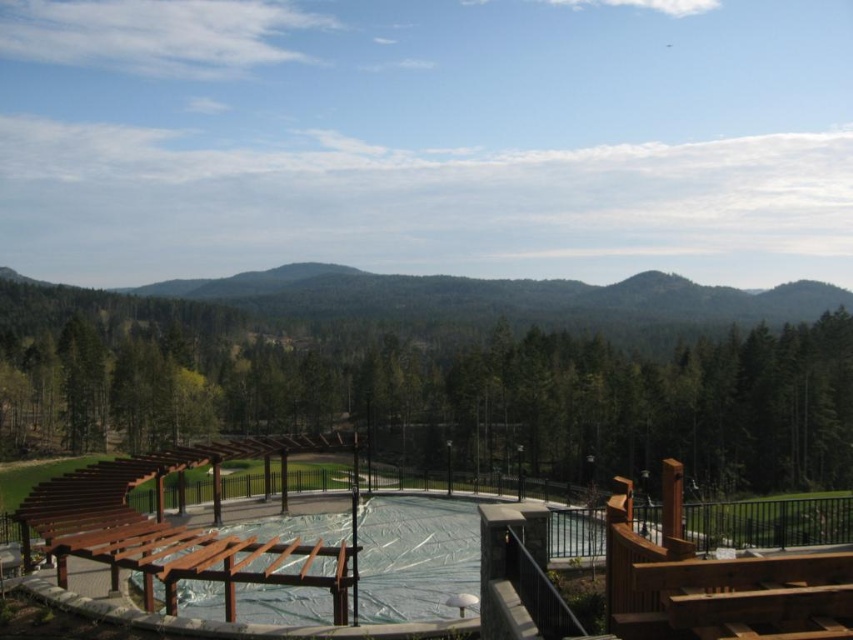
Question: Which point is closer to the camera?

Choices:
 (A) (103, 540)
 (B) (281, 419)

Answer: (A)

Question: Does green wood trees at center appear on the left side of brown wooden deck at center?

Choices:
 (A) no
 (B) yes

Answer: (A)

Question: Which of the following is the farthest from the observer?

Choices:
 (A) green wood trees at center
 (B) brown wooden deck at center

Answer: (A)

Question: Is green wood trees at center wider than brown wooden deck at center?

Choices:
 (A) yes
 (B) no

Answer: (A)

Question: Can you confirm if green wood trees at center is positioned to the right of brown wooden deck at center?

Choices:
 (A) no
 (B) yes

Answer: (B)

Question: Which point is farther to the camera?

Choices:
 (A) (62, 384)
 (B) (677, 579)

Answer: (A)